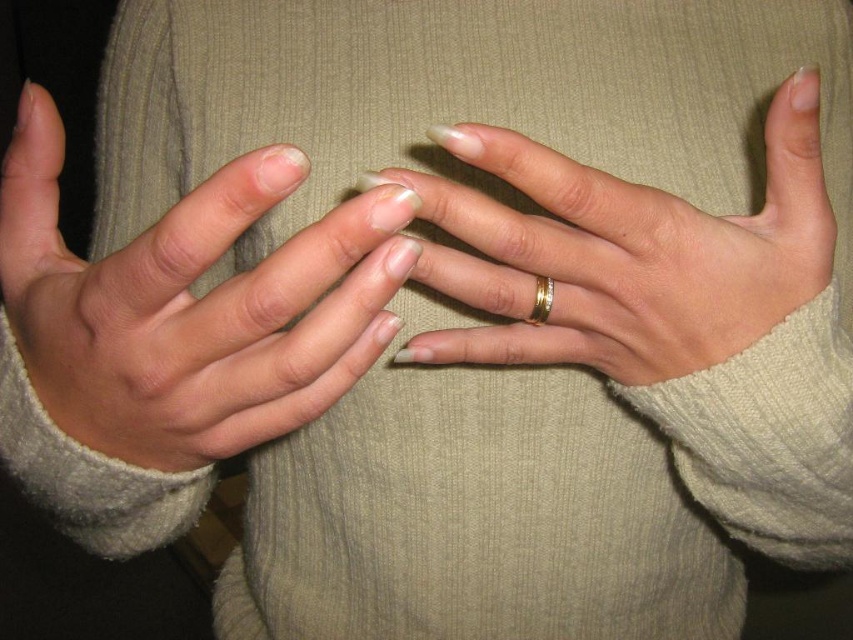
Question: In this image, where is gold metallic ring at center located relative to gold shiny ring at center?

Choices:
 (A) right
 (B) left

Answer: (A)

Question: Does matte gold ring at center appear over gold metallic ring at center?

Choices:
 (A) no
 (B) yes

Answer: (A)

Question: Which of the following is the farthest from the observer?

Choices:
 (A) (587, 252)
 (B) (543, 288)
 (C) (213, 452)

Answer: (B)

Question: Which object is the farthest from the gold shiny ring at center?

Choices:
 (A) gold metallic ring at center
 (B) matte gold ring at center

Answer: (B)

Question: Which object appears closest to the camera in this image?

Choices:
 (A) matte gold ring at center
 (B) gold shiny ring at center
 (C) gold metallic ring at center

Answer: (A)

Question: Considering the relative positions of matte gold ring at center and gold shiny ring at center in the image provided, where is matte gold ring at center located with respect to gold shiny ring at center?

Choices:
 (A) above
 (B) below

Answer: (A)